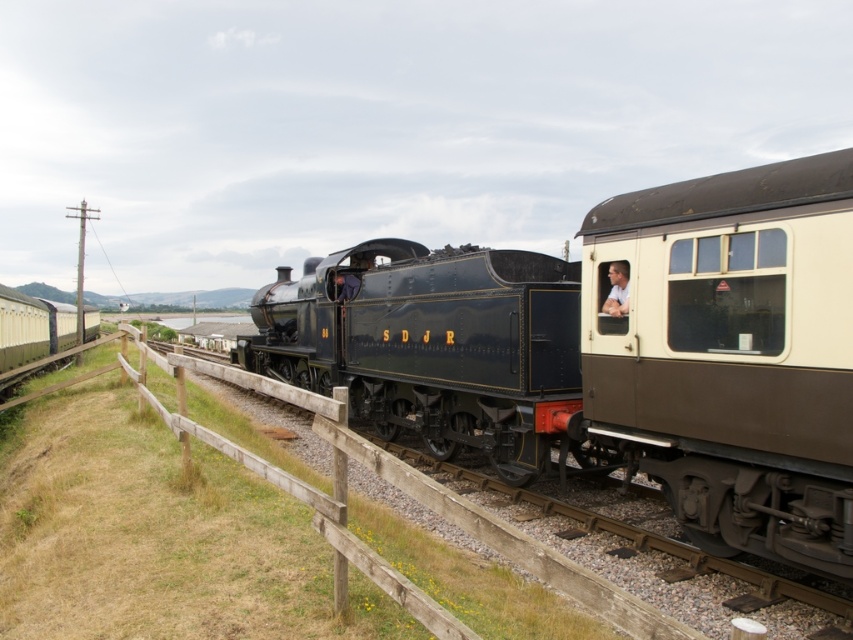
Question: In this image, where is polished dark blue locomotive at center located relative to light blue shirt at center?

Choices:
 (A) below
 (B) above

Answer: (A)

Question: Which object is farther from the camera taking this photo?

Choices:
 (A) matte cream passenger car at right
 (B) light blue shirt at center

Answer: (B)

Question: Does matte cream passenger car at right have a lesser width compared to matte black locomotive at center?

Choices:
 (A) no
 (B) yes

Answer: (B)

Question: Considering the real-world distances, which object is farthest from the polished dark blue locomotive at center?

Choices:
 (A) matte cream passenger car at right
 (B) light blue shirt at center
 (C) matte black locomotive at center

Answer: (B)

Question: Is matte cream passenger car at right wider than matte black locomotive at center?

Choices:
 (A) no
 (B) yes

Answer: (A)

Question: Which object is positioned closest to the matte black locomotive at center?

Choices:
 (A) polished dark blue locomotive at center
 (B) light blue shirt at center
 (C) matte cream passenger car at right

Answer: (A)